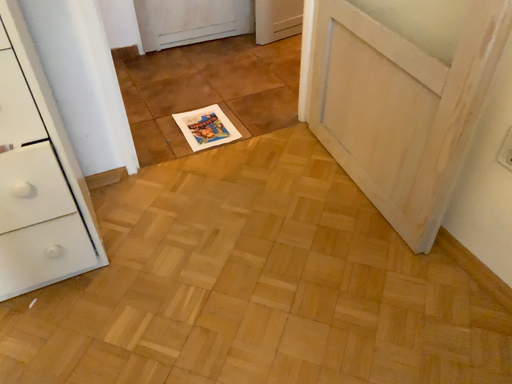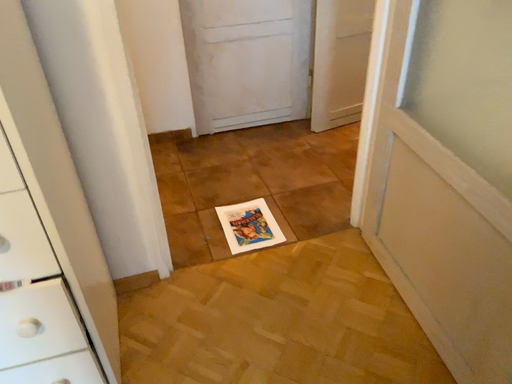
Question: How did the camera likely rotate when shooting the video?

Choices:
 (A) rotated right
 (B) rotated left

Answer: (B)